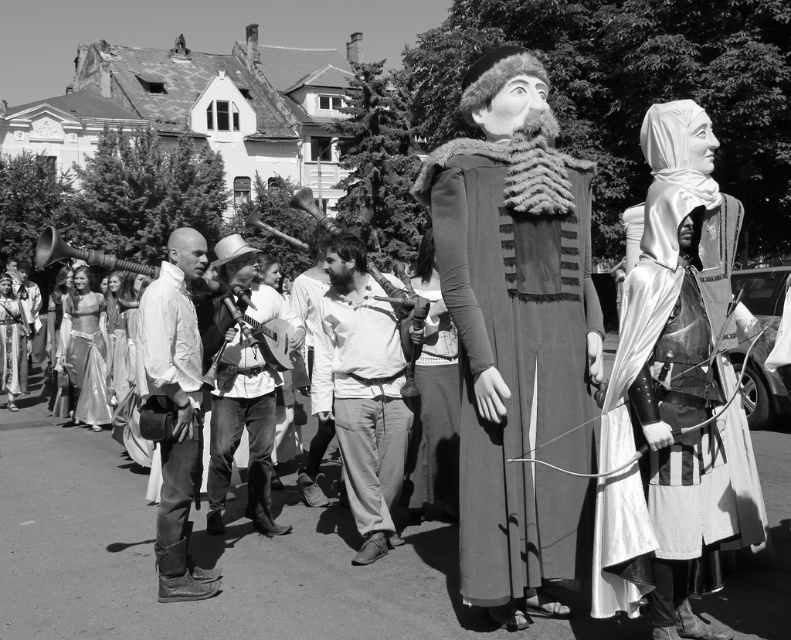
You are a photographer trying to capture both the silvery metallic armor at right and the silky white dress at left in a single frame. Based on their positions, which object should you focus on first to ensure both are in the shot?

The silvery metallic armor at right is located above the silky white dress at left, so you should focus on the silvery metallic armor at right first to ensure both are in the shot.

You are a photographer trying to capture the two puppets in the street scene. You notice two points marked in the image. Which point, point [433,465] or point [65,321], is closer to your camera lens?

Point [433,465] is closer to the camera than point [65,321].